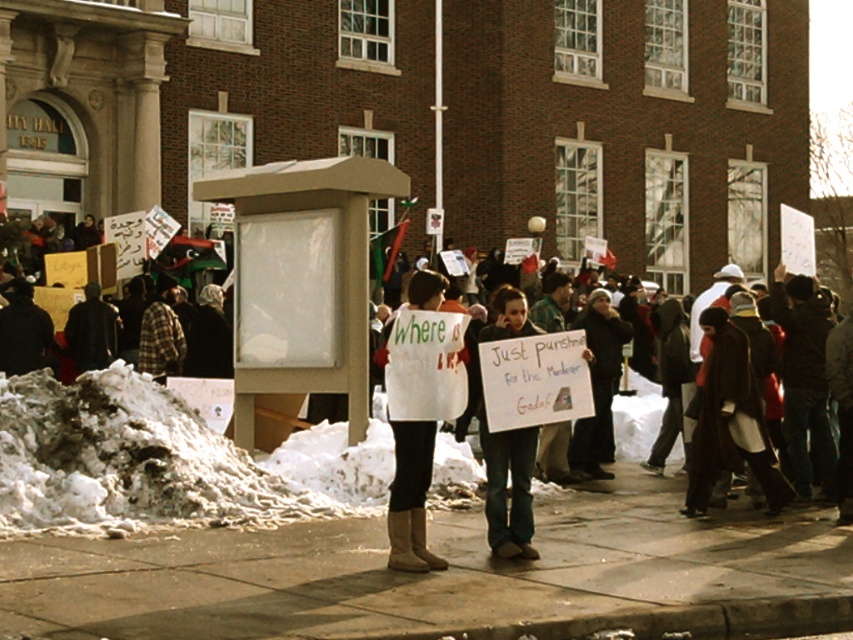
Question: Does smooth concrete sidewalk at center appear on the right side of white fabric sign at center?

Choices:
 (A) no
 (B) yes

Answer: (A)

Question: Which point appears farthest from the camera in this image?

Choices:
 (A) (312, 556)
 (B) (393, 484)

Answer: (A)

Question: Which object is closer to the camera taking this photo?

Choices:
 (A) smooth concrete sidewalk at center
 (B) white fabric sign at center

Answer: (A)

Question: Is smooth concrete sidewalk at center above white fabric sign at center?

Choices:
 (A) yes
 (B) no

Answer: (B)

Question: Is smooth concrete sidewalk at center further to the viewer compared to white fabric sign at center?

Choices:
 (A) yes
 (B) no

Answer: (B)

Question: Which object is farther from the camera taking this photo?

Choices:
 (A) white fabric sign at center
 (B) smooth concrete sidewalk at center

Answer: (A)